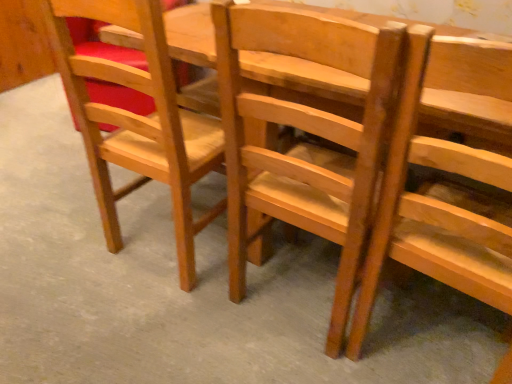
Identify the location of vacant space underneath light brown wood chair at center, the second chair from the right (from a real-world perspective). Image resolution: width=512 pixels, height=384 pixels. (295, 293).